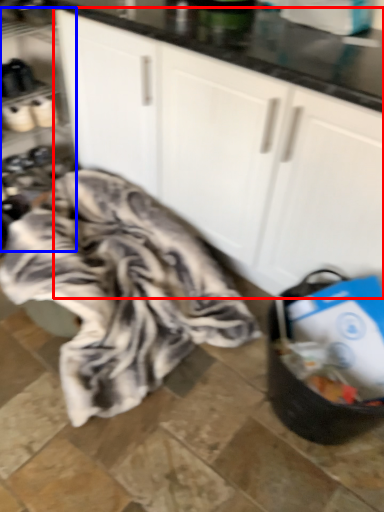
Question: Which of the following is the closest to the observer, cabinetry (highlighted by a red box) or shelf (highlighted by a blue box)?

Choices:
 (A) cabinetry
 (B) shelf

Answer: (A)